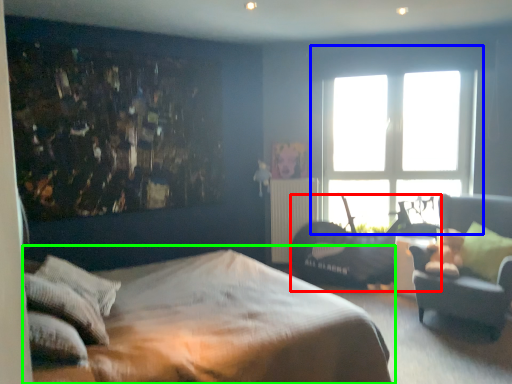
Question: Which object is the closest to the swivel chair (highlighted by a red box)? Choose among these: window (highlighted by a blue box) or bed (highlighted by a green box).

Choices:
 (A) window
 (B) bed

Answer: (A)